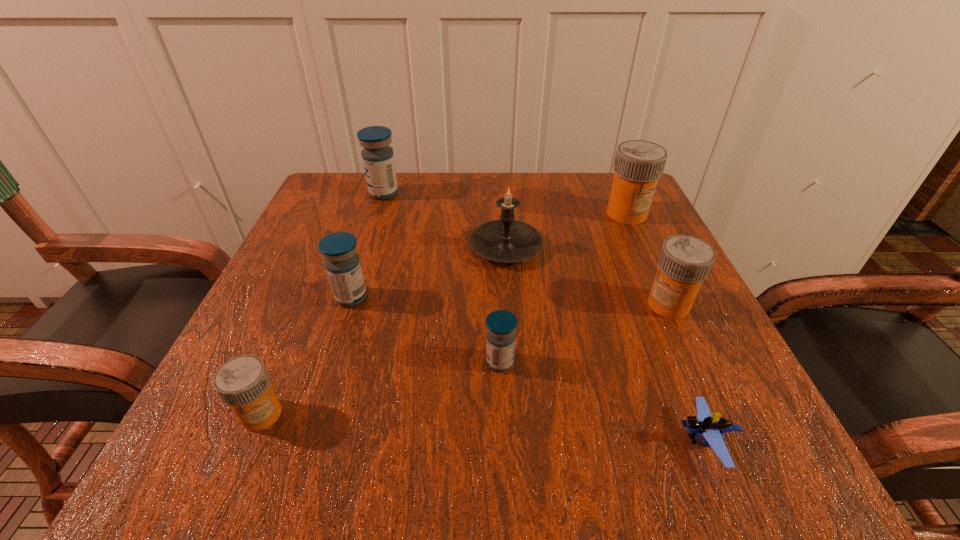
Locate an element on the screen. empty space that is in between the second nearest blue medicine and the blue Lego is located at coordinates (528, 369).

The height and width of the screenshot is (540, 960). In order to click on free space between the candle and the second nearest blue medicine in this screenshot , I will do `click(428, 273)`.

Find the location of `free space between the second farthest orange medicine and the seventh nearest object`. free space between the second farthest orange medicine and the seventh nearest object is located at coordinates (648, 259).

In order to click on empty space that is in between the Lego and the smallest blue medicine in this screenshot , I will do `click(603, 402)`.

I want to click on free space between the nearest medicine and the second smallest orange medicine, so click(x=465, y=359).

Where is `vacant area that lies between the candle and the second smallest orange medicine`? This screenshot has height=540, width=960. vacant area that lies between the candle and the second smallest orange medicine is located at coordinates (588, 276).

Locate an element on the screen. vacant space in between the second farthest orange medicine and the smallest blue medicine is located at coordinates point(585,333).

At what (x,y) coordinates should I click in order to perform the action: click on blank region between the fifth nearest medicine and the leftmost object. Please return your answer as a coordinate pair (x, y). Image resolution: width=960 pixels, height=540 pixels. Looking at the image, I should click on (444, 314).

Identify which object is the fourth closest to the farthest blue medicine. Please provide its 2D coordinates. Your answer should be formatted as a tuple, i.e. [(x, y)], where the tuple contains the x and y coordinates of a point satisfying the conditions above.

[(501, 325)]

You are a GUI agent. You are given a task and a screenshot of the screen. Output one action in this format:
    pyautogui.click(x=<x>, y=<y>)
    Task: Click on the object that is the sixth nearest to the fifth nearest medicine
    The width and height of the screenshot is (960, 540).
    Given the screenshot: What is the action you would take?
    pyautogui.click(x=342, y=263)